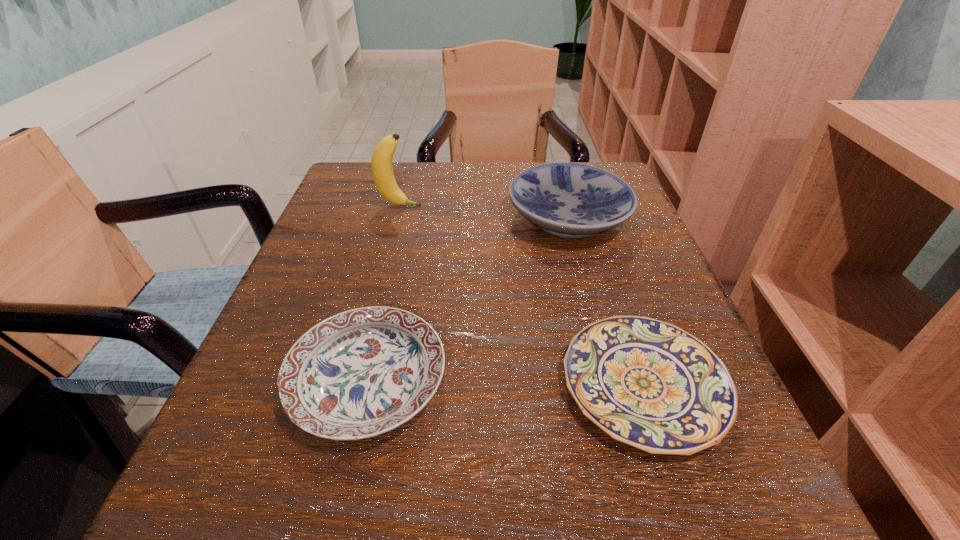
This screenshot has height=540, width=960. Identify the location of banana that is at the far edge. (382, 170).

At what (x,y) coordinates should I click in order to perform the action: click on plate situated at the far edge. Please return your answer as a coordinate pair (x, y). Looking at the image, I should click on (570, 200).

Identify the location of object present at the near edge. This screenshot has width=960, height=540. (649, 384).

You are a GUI agent. You are given a task and a screenshot of the screen. Output one action in this format:
    pyautogui.click(x=<x>, y=<y>)
    Task: Click on the banana that is at the left edge
    This screenshot has height=540, width=960.
    Given the screenshot: What is the action you would take?
    pyautogui.click(x=382, y=170)

Image resolution: width=960 pixels, height=540 pixels. What are the coordinates of `plate located at the left edge` in the screenshot? It's located at (360, 373).

Image resolution: width=960 pixels, height=540 pixels. I want to click on object that is at the far left corner, so click(x=382, y=170).

The image size is (960, 540). In order to click on object that is at the far right corner in this screenshot , I will do `click(570, 200)`.

The width and height of the screenshot is (960, 540). What are the coordinates of `object that is positioned at the near right corner` in the screenshot? It's located at (649, 384).

The width and height of the screenshot is (960, 540). I want to click on free space at the far edge, so click(439, 197).

The height and width of the screenshot is (540, 960). Find the location of `blank space at the left edge of the desktop`. blank space at the left edge of the desktop is located at coordinates (300, 338).